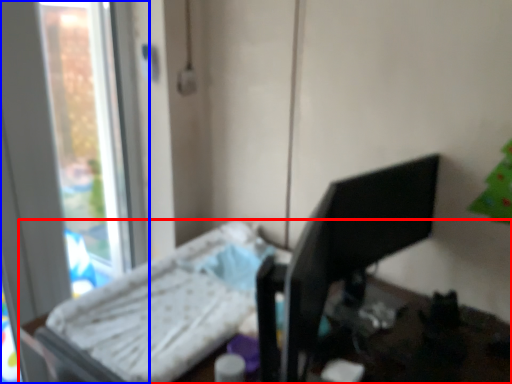
Question: Which object is closer to the camera taking this photo, furniture (highlighted by a red box) or window (highlighted by a blue box)?

Choices:
 (A) furniture
 (B) window

Answer: (A)